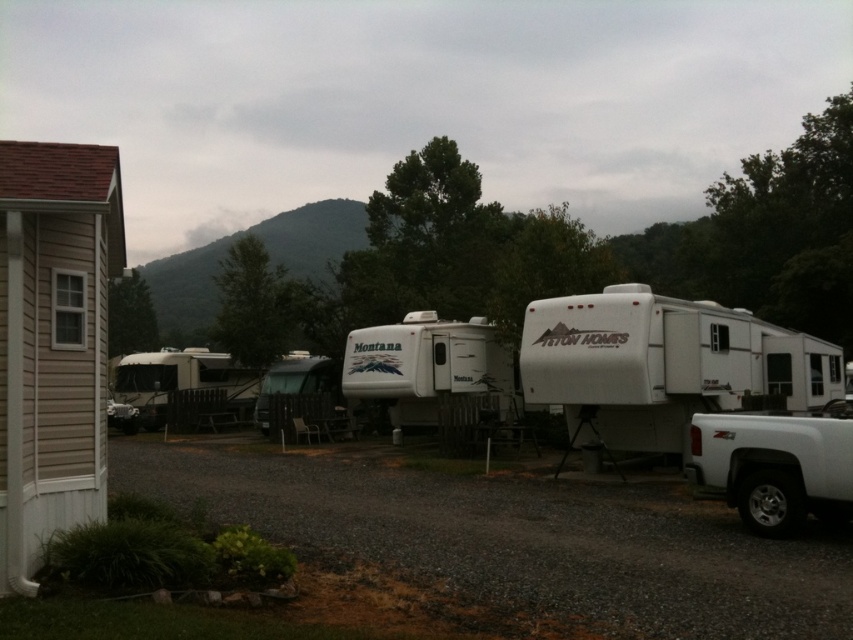
Question: Is white matte pickup truck at center-right bigger than white matte camper at center?

Choices:
 (A) yes
 (B) no

Answer: (A)

Question: Which point appears farthest from the camera in this image?

Choices:
 (A) (479, 364)
 (B) (788, 404)

Answer: (A)

Question: In this image, where is white matte pickup truck at center-right located relative to white matte camper at center?

Choices:
 (A) left
 (B) right

Answer: (B)

Question: Which point is closer to the camera taking this photo?

Choices:
 (A) (395, 362)
 (B) (547, 372)

Answer: (B)

Question: Is white matte pickup truck at center-right further to the viewer compared to white matte camper at center?

Choices:
 (A) yes
 (B) no

Answer: (B)